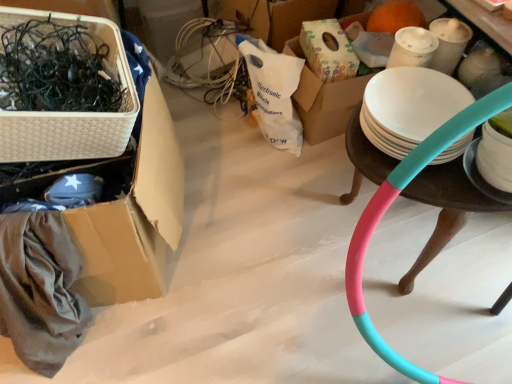
Question: Is teal matte hula hoop at right at the right side of white matte plate at right?

Choices:
 (A) no
 (B) yes

Answer: (B)

Question: Is teal matte hula hoop at right at the left side of white matte plate at right?

Choices:
 (A) yes
 (B) no

Answer: (B)

Question: Considering the relative positions of teal matte hula hoop at right and white matte plate at right in the image provided, is teal matte hula hoop at right in front of white matte plate at right?

Choices:
 (A) no
 (B) yes

Answer: (B)

Question: From a real-world perspective, is teal matte hula hoop at right located beneath white matte plate at right?

Choices:
 (A) no
 (B) yes

Answer: (B)

Question: From a real-world perspective, is teal matte hula hoop at right located higher than white matte plate at right?

Choices:
 (A) yes
 (B) no

Answer: (B)

Question: From the image's perspective, is teal matte hula hoop at right over white matte plate at right?

Choices:
 (A) no
 (B) yes

Answer: (A)

Question: Is white wicker basket at upper left bigger than white matte plate at right?

Choices:
 (A) no
 (B) yes

Answer: (B)

Question: From the image's perspective, is white wicker basket at upper left above white matte plate at right?

Choices:
 (A) yes
 (B) no

Answer: (A)

Question: Is there a large distance between white wicker basket at upper left and white matte plate at right?

Choices:
 (A) no
 (B) yes

Answer: (A)

Question: Is white wicker basket at upper left further to camera compared to white matte plate at right?

Choices:
 (A) no
 (B) yes

Answer: (A)

Question: Is white wicker basket at upper left taller than white matte plate at right?

Choices:
 (A) no
 (B) yes

Answer: (B)

Question: Does white wicker basket at upper left have a smaller size compared to white matte plate at right?

Choices:
 (A) yes
 (B) no

Answer: (B)

Question: Is white wicker basket at upper left closer to camera compared to teal matte hula hoop at right?

Choices:
 (A) yes
 (B) no

Answer: (A)